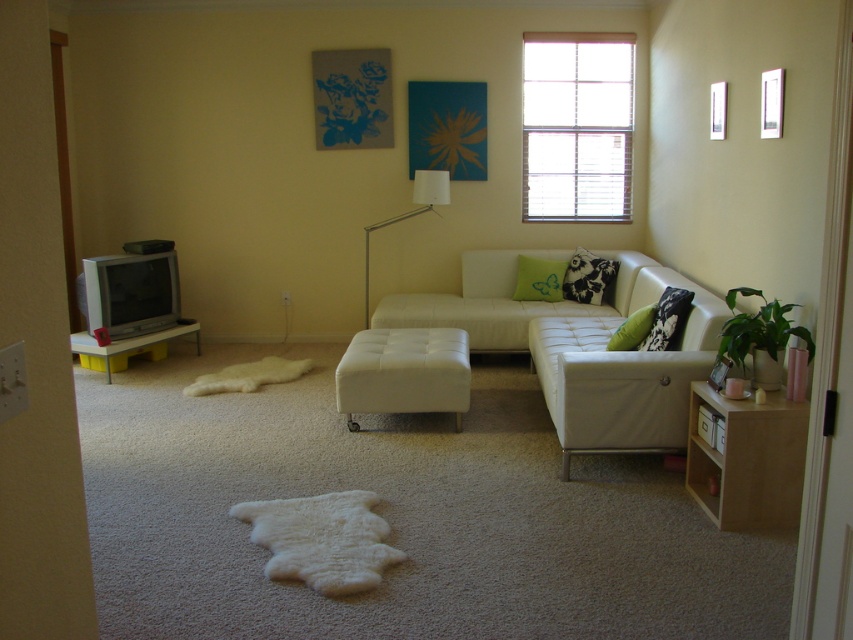
Can you confirm if matte yellow plastic tv stand at left is positioned to the right of green velvet pillow at center?

No, matte yellow plastic tv stand at left is not to the right of green velvet pillow at center.

Find the location of a particular element. The height and width of the screenshot is (640, 853). matte yellow plastic tv stand at left is located at coordinates (128, 342).

Where is `matte yellow plastic tv stand at left`? Image resolution: width=853 pixels, height=640 pixels. matte yellow plastic tv stand at left is located at coordinates (128, 342).

Is white leather ottoman at center smaller than black printed pillow at right?

Actually, white leather ottoman at center might be larger than black printed pillow at right.

Which is behind, point (402, 397) or point (676, 339)?

The point (402, 397) is more distant.

Describe the element at coordinates (403, 372) in the screenshot. The image size is (853, 640). I see `white leather ottoman at center` at that location.

Locate an element on the screen. The height and width of the screenshot is (640, 853). white leather ottoman at center is located at coordinates (403, 372).

Which of these two, green fabric pillow at center or green velvet pillow at center, stands shorter?

With less height is green velvet pillow at center.

Where is `green fabric pillow at center`? green fabric pillow at center is located at coordinates (538, 278).